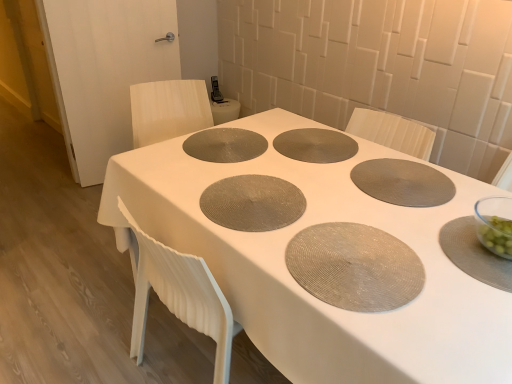
Identify the location of vacant space situated above matte gray placemat at center, positioned as the second pizza pan in right-to-left order (from a real-world perspective). (312, 138).